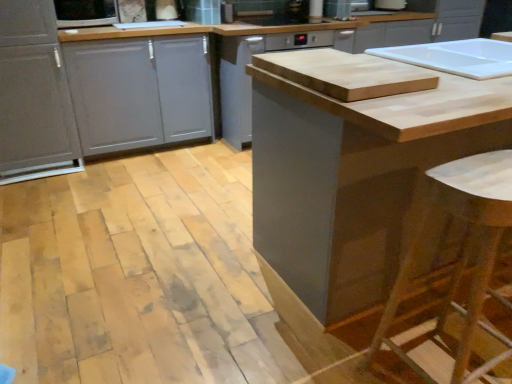
At what (x,y) coordinates should I click in order to perform the action: click on vacant space situated on the left part of wooden bar stool at lower right. Please return your answer as a coordinate pair (x, y). Looking at the image, I should click on (322, 352).